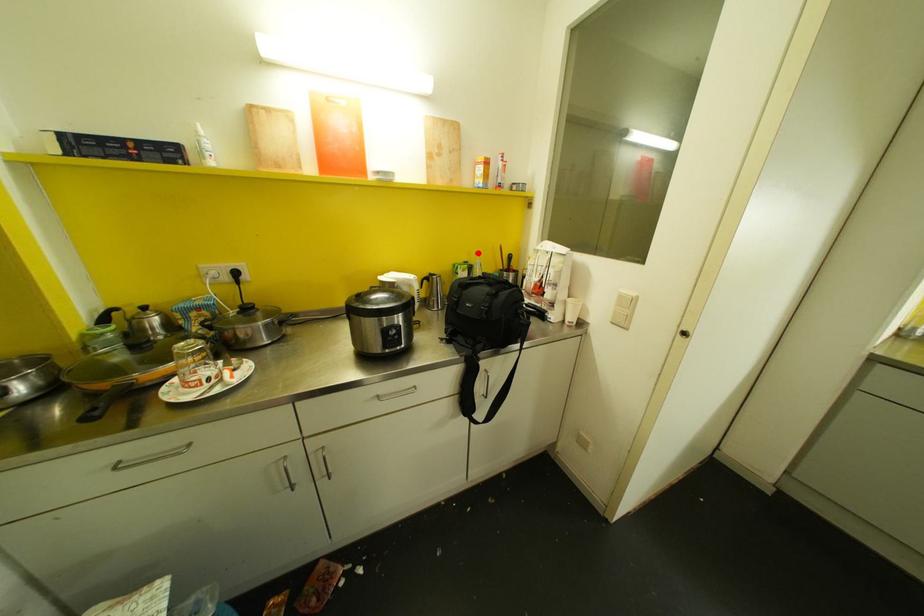
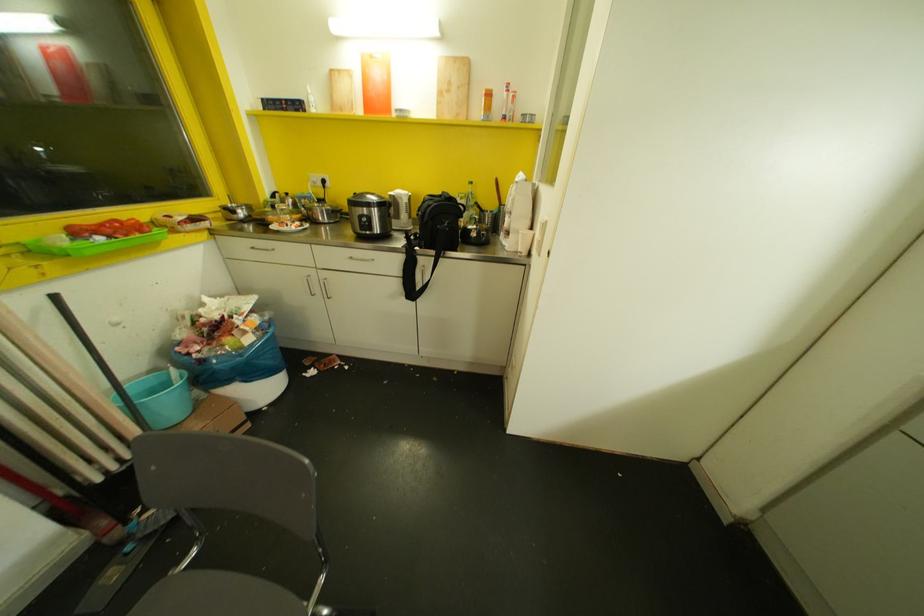
Locate, in the second image, the point that corresponds to the highlighted location in the first image.

(469, 182)